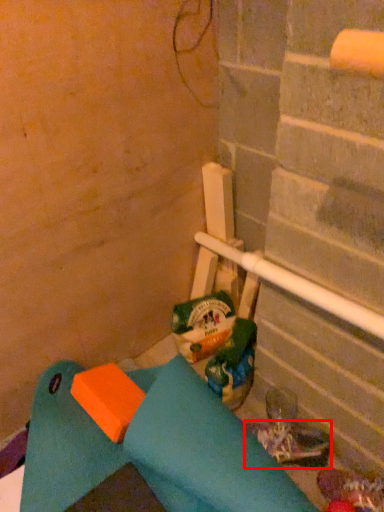
Question: Where is footwear (annotated by the red box) located in relation to garbage in the image?

Choices:
 (A) left
 (B) right

Answer: (B)